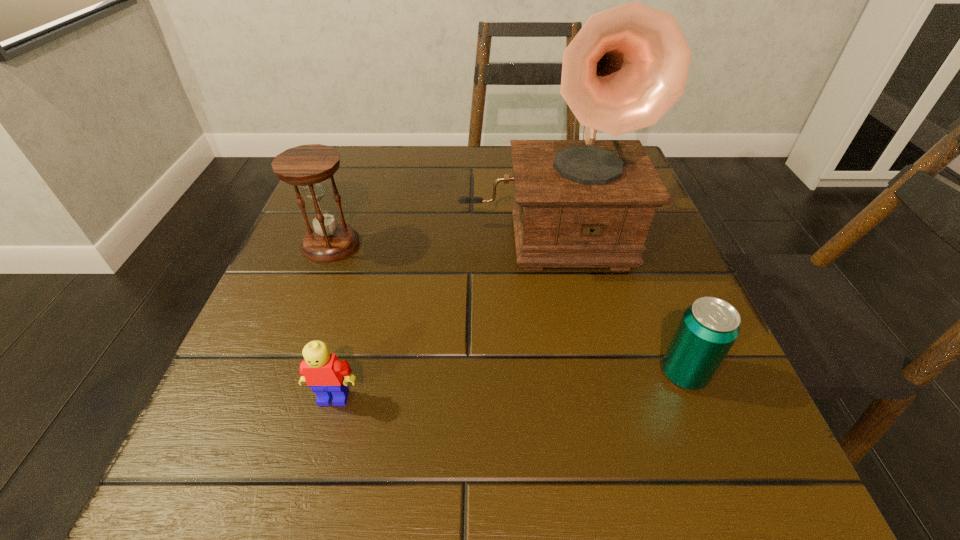
Find the location of a particular element. the tallest object is located at coordinates (589, 203).

Identify the location of hourglass. (309, 166).

Identify the location of beer can. Image resolution: width=960 pixels, height=540 pixels. (709, 327).

Locate an element on the screen. The width and height of the screenshot is (960, 540). Lego is located at coordinates (327, 376).

Find the location of a particular element. blank area located on the horn of the record player is located at coordinates (567, 370).

Find the location of `vacant region located 0.100m on the front of the hourglass`. vacant region located 0.100m on the front of the hourglass is located at coordinates click(308, 306).

Locate an element on the screen. blank space located on the left of the beer can is located at coordinates (515, 374).

Where is `object present at the far edge`? The width and height of the screenshot is (960, 540). object present at the far edge is located at coordinates (589, 203).

Identify the location of hourglass at the left edge. The image size is (960, 540). (309, 166).

I want to click on Lego located in the left edge section of the desktop, so click(x=327, y=376).